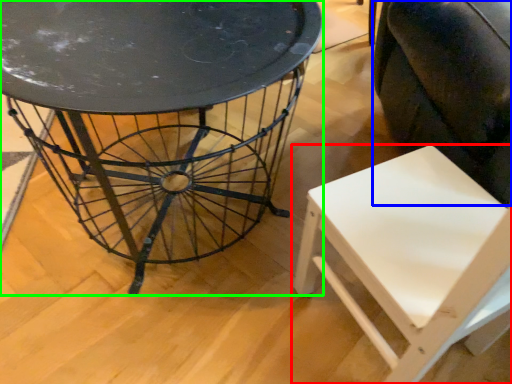
Question: Which object is positioned farthest from chair (highlighted by a red box)? Select from swivel chair (highlighted by a blue box) and table (highlighted by a green box).

Choices:
 (A) swivel chair
 (B) table

Answer: (B)